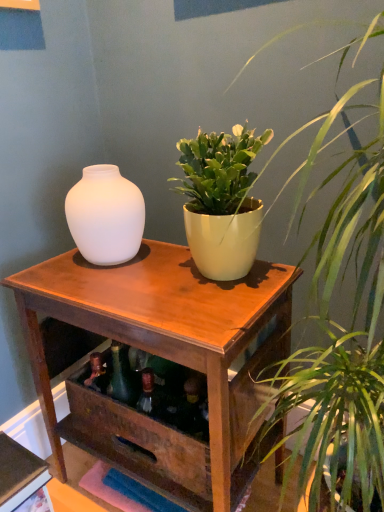
What is the approximate height of wooden table at center?

wooden table at center is 27.89 inches in height.

What is the approximate width of wooden table at center?

wooden table at center is 39.89 centimeters wide.

Measure the distance between matte yellow pot at upper center, placed as the 1th houseplant when sorted from bottom to top, and camera.

matte yellow pot at upper center, placed as the 1th houseplant when sorted from bottom to top, and camera are 19.33 inches apart.

This screenshot has height=512, width=384. Find the location of `matte white vase at left`. matte white vase at left is located at coordinates pyautogui.click(x=105, y=215).

Is wooden table at center facing towards matte yellow pot at upper center, placed as the 1th houseplant when sorted from bottom to top?

No, wooden table at center is not turned towards matte yellow pot at upper center, placed as the 1th houseplant when sorted from bottom to top.

Is wooden table at center bigger than matte yellow pot at upper center, marked as the 2th houseplant in a top-to-bottom arrangement?

Actually, wooden table at center might be smaller than matte yellow pot at upper center, marked as the 2th houseplant in a top-to-bottom arrangement.

Identify the location of table that is below the matte yellow pot at upper center, placed as the 1th houseplant when sorted from bottom to top (from the image's perspective). (156, 352).

Is green matte plant pot at center, marked as the 1th houseplant in a top-to-bottom arrangement, positioned beyond the bounds of matte yellow pot at upper center, placed as the 1th houseplant when sorted from bottom to top?

green matte plant pot at center, marked as the 1th houseplant in a top-to-bottom arrangement, lies outside matte yellow pot at upper center, placed as the 1th houseplant when sorted from bottom to top,'s area.

Is point (244, 214) closer to viewer compared to point (378, 425)?

No, (244, 214) is behind (378, 425).

Is green matte plant pot at center, the 2th houseplant when ordered from bottom to top, aimed at matte yellow pot at upper center, placed as the 1th houseplant when sorted from bottom to top?

No, green matte plant pot at center, the 2th houseplant when ordered from bottom to top, is not oriented towards matte yellow pot at upper center, placed as the 1th houseplant when sorted from bottom to top.

Considering the positions of objects green matte plant pot at center, the 2th houseplant when ordered from bottom to top, and matte yellow pot at upper center, placed as the 1th houseplant when sorted from bottom to top, in the image provided, who is more to the right, green matte plant pot at center, the 2th houseplant when ordered from bottom to top, or matte yellow pot at upper center, placed as the 1th houseplant when sorted from bottom to top,?

Positioned to the right is matte yellow pot at upper center, placed as the 1th houseplant when sorted from bottom to top.

Looking at this image, can you confirm if matte yellow pot at upper center, marked as the 2th houseplant in a top-to-bottom arrangement, is shorter than green matte plant pot at center, marked as the 1th houseplant in a top-to-bottom arrangement?

Incorrect, the height of matte yellow pot at upper center, marked as the 2th houseplant in a top-to-bottom arrangement, does not fall short of that of green matte plant pot at center, marked as the 1th houseplant in a top-to-bottom arrangement.

Could you tell me if matte yellow pot at upper center, marked as the 2th houseplant in a top-to-bottom arrangement, is facing green matte plant pot at center, the 2th houseplant when ordered from bottom to top?

No, matte yellow pot at upper center, marked as the 2th houseplant in a top-to-bottom arrangement, is not turned towards green matte plant pot at center, the 2th houseplant when ordered from bottom to top.

Where is `houseplant behind the matte yellow pot at upper center, marked as the 2th houseplant in a top-to-bottom arrangement`? Image resolution: width=384 pixels, height=512 pixels. houseplant behind the matte yellow pot at upper center, marked as the 2th houseplant in a top-to-bottom arrangement is located at coordinates (221, 201).

From the image's perspective, is matte yellow pot at upper center, placed as the 1th houseplant when sorted from bottom to top, beneath green matte plant pot at center, the 2th houseplant when ordered from bottom to top?

Yes, from the image's perspective, matte yellow pot at upper center, placed as the 1th houseplant when sorted from bottom to top, is beneath green matte plant pot at center, the 2th houseplant when ordered from bottom to top.

Is matte white vase at left positioned with its back to green matte plant pot at center, marked as the 1th houseplant in a top-to-bottom arrangement?

That's not correct — matte white vase at left is not looking away from green matte plant pot at center, marked as the 1th houseplant in a top-to-bottom arrangement.

Which of these two, matte white vase at left or green matte plant pot at center, the 2th houseplant when ordered from bottom to top, stands taller?

With more height is green matte plant pot at center, the 2th houseplant when ordered from bottom to top.

In terms of size, does matte white vase at left appear bigger or smaller than green matte plant pot at center, marked as the 1th houseplant in a top-to-bottom arrangement?

In the image, matte white vase at left appears to be smaller than green matte plant pot at center, marked as the 1th houseplant in a top-to-bottom arrangement.

Can you tell me how much matte white vase at left and green matte plant pot at center, marked as the 1th houseplant in a top-to-bottom arrangement, differ in facing direction?

3.48 degrees separate the facing orientations of matte white vase at left and green matte plant pot at center, marked as the 1th houseplant in a top-to-bottom arrangement.

Does matte white vase at left have a larger size compared to wooden table at center?

Incorrect, matte white vase at left is not larger than wooden table at center.

How different are the orientations of matte white vase at left and wooden table at center in degrees?

matte white vase at left and wooden table at center are facing 0.121 degrees away from each other.

Is point (109, 250) farther from viewer compared to point (175, 283)?

That is True.

Can you confirm if matte white vase at left is taller than wooden table at center?

In fact, matte white vase at left may be shorter than wooden table at center.

In the scene shown: Which point is more distant from viewer, (229, 395) or (190, 192)?

The point (190, 192) is farther.

Where is `table that is under the green matte plant pot at center, marked as the 1th houseplant in a top-to-bottom arrangement (from a real-world perspective)`? table that is under the green matte plant pot at center, marked as the 1th houseplant in a top-to-bottom arrangement (from a real-world perspective) is located at coordinates (156, 352).

Is wooden table at center to the left of green matte plant pot at center, marked as the 1th houseplant in a top-to-bottom arrangement, from the viewer's perspective?

Yes, wooden table at center is to the left of green matte plant pot at center, marked as the 1th houseplant in a top-to-bottom arrangement.

Is wooden table at center positioned with its back to green matte plant pot at center, the 2th houseplant when ordered from bottom to top?

No, wooden table at center is not facing the opposite direction of green matte plant pot at center, the 2th houseplant when ordered from bottom to top.

Who is smaller, matte white vase at left or matte yellow pot at upper center, placed as the 1th houseplant when sorted from bottom to top?

matte white vase at left.

From the image's perspective, which one is positioned lower, matte white vase at left or matte yellow pot at upper center, marked as the 2th houseplant in a top-to-bottom arrangement?

matte yellow pot at upper center, marked as the 2th houseplant in a top-to-bottom arrangement.

In the scene shown: From a real-world perspective, who is located higher, matte white vase at left or matte yellow pot at upper center, marked as the 2th houseplant in a top-to-bottom arrangement?

matte white vase at left.

Which object is positioned more to the left, matte white vase at left or matte yellow pot at upper center, marked as the 2th houseplant in a top-to-bottom arrangement?

matte white vase at left is more to the left.

Locate an element on the screen. This screenshot has height=512, width=384. table beneath the matte yellow pot at upper center, placed as the 1th houseplant when sorted from bottom to top (from a real-world perspective) is located at coordinates pyautogui.click(x=156, y=352).

Locate an element on the screen. Image resolution: width=384 pixels, height=512 pixels. houseplant in front of the green matte plant pot at center, marked as the 1th houseplant in a top-to-bottom arrangement is located at coordinates (352, 314).

From the image, which object appears to be nearer to green matte plant pot at center, the 2th houseplant when ordered from bottom to top, matte white vase at left or wooden table at center?

matte white vase at left is closer to green matte plant pot at center, the 2th houseplant when ordered from bottom to top.

From the image, which object appears to be nearer to wooden table at center, matte white vase at left or matte yellow pot at upper center, marked as the 2th houseplant in a top-to-bottom arrangement?

matte white vase at left lies closer to wooden table at center than the other object.

Estimate the real-world distances between objects in this image. Which object is closer to matte yellow pot at upper center, placed as the 1th houseplant when sorted from bottom to top, wooden table at center or matte white vase at left?

wooden table at center lies closer to matte yellow pot at upper center, placed as the 1th houseplant when sorted from bottom to top, than the other object.

Based on their spatial positions, is matte yellow pot at upper center, marked as the 2th houseplant in a top-to-bottom arrangement, or green matte plant pot at center, the 2th houseplant when ordered from bottom to top, closer to wooden table at center?

green matte plant pot at center, the 2th houseplant when ordered from bottom to top.

Considering their positions, is wooden table at center positioned closer to matte white vase at left than matte yellow pot at upper center, marked as the 2th houseplant in a top-to-bottom arrangement?

Among the two, wooden table at center is located nearer to matte white vase at left.

Based on their spatial positions, is wooden table at center or green matte plant pot at center, marked as the 1th houseplant in a top-to-bottom arrangement, further from matte white vase at left?

Among the two, wooden table at center is located further to matte white vase at left.

Based on their spatial positions, is matte white vase at left or green matte plant pot at center, marked as the 1th houseplant in a top-to-bottom arrangement, closer to matte yellow pot at upper center, marked as the 2th houseplant in a top-to-bottom arrangement?

Based on the image, green matte plant pot at center, marked as the 1th houseplant in a top-to-bottom arrangement, appears to be nearer to matte yellow pot at upper center, marked as the 2th houseplant in a top-to-bottom arrangement.

In the scene shown: Which object lies nearer to the anchor point wooden table at center, matte white vase at left or green matte plant pot at center, marked as the 1th houseplant in a top-to-bottom arrangement?

Among the two, green matte plant pot at center, marked as the 1th houseplant in a top-to-bottom arrangement, is located nearer to wooden table at center.

The image size is (384, 512). What are the coordinates of `table between matte yellow pot at upper center, marked as the 2th houseplant in a top-to-bottom arrangement, and green matte plant pot at center, marked as the 1th houseplant in a top-to-bottom arrangement, in the front-back direction` in the screenshot? It's located at (156, 352).

Find the location of a particular element. The image size is (384, 512). vase between green matte plant pot at center, marked as the 1th houseplant in a top-to-bottom arrangement, and wooden table at center, in the vertical direction is located at coordinates coord(105,215).

What are the coordinates of `table between matte yellow pot at upper center, placed as the 1th houseplant when sorted from bottom to top, and matte white vase at left in the front-back direction` in the screenshot? It's located at (156, 352).

Identify the location of houseplant between matte yellow pot at upper center, marked as the 2th houseplant in a top-to-bottom arrangement, and matte white vase at left in the front-back direction. Image resolution: width=384 pixels, height=512 pixels. (221, 201).